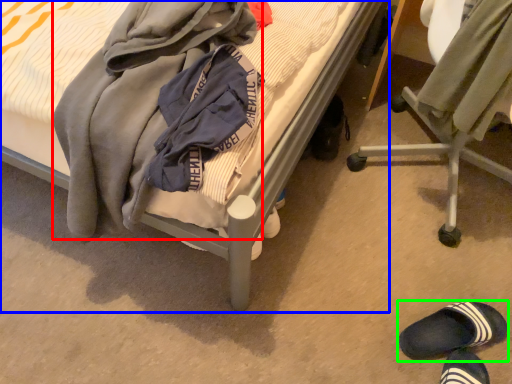
Question: Based on their relative distances, which object is farther from clothing (highlighted by a red box)? Choose from bed (highlighted by a blue box) and footwear (highlighted by a green box).

Choices:
 (A) bed
 (B) footwear

Answer: (B)